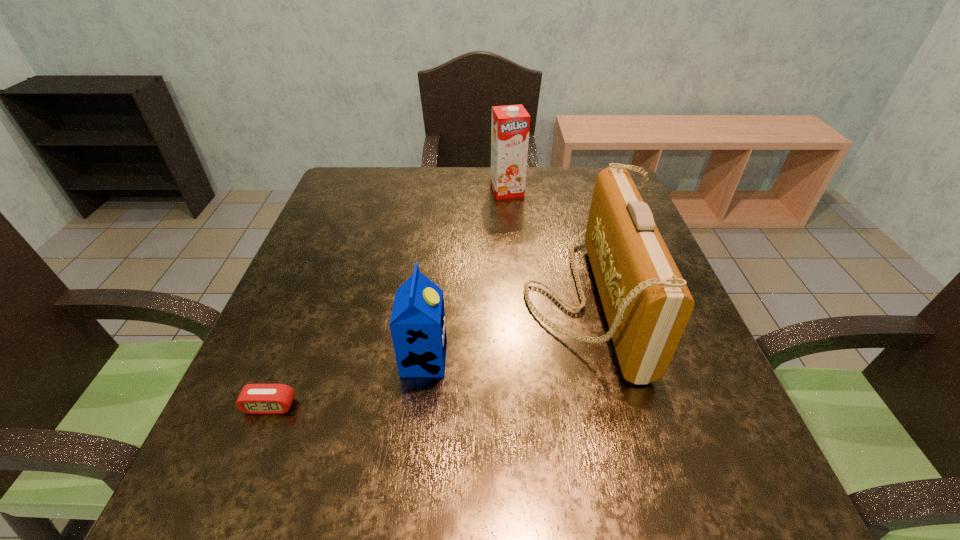
Image resolution: width=960 pixels, height=540 pixels. In order to click on vacant space at the near left corner in this screenshot , I will do `click(251, 493)`.

In order to click on blank space at the far right corner of the desktop in this screenshot , I will do `click(574, 200)`.

This screenshot has width=960, height=540. I want to click on free space that is in between the alarm clock and the shorter carton, so click(x=348, y=383).

In order to click on vacant region between the third tallest object and the handbag in this screenshot , I will do `click(505, 328)`.

The image size is (960, 540). What are the coordinates of `vacant area between the handbag and the left carton` in the screenshot? It's located at (505, 328).

Image resolution: width=960 pixels, height=540 pixels. I want to click on empty location between the third object from right to left and the handbag, so pos(505,328).

Find the location of `empty space between the nearer carton and the farther carton`. empty space between the nearer carton and the farther carton is located at coordinates (466, 275).

The height and width of the screenshot is (540, 960). I want to click on free space between the right carton and the left carton, so click(x=466, y=275).

This screenshot has width=960, height=540. Find the location of `free space between the handbag and the farther carton`. free space between the handbag and the farther carton is located at coordinates (546, 244).

Find the location of a particular element. This screenshot has width=960, height=540. blank region between the nearest object and the right carton is located at coordinates (389, 298).